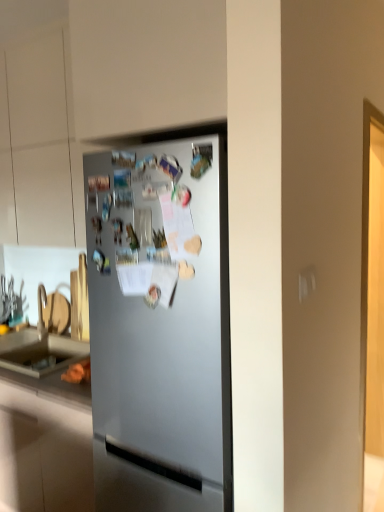
Question: Can you confirm if matte gray countertop at lower left is wider than satin silver fridge at center?

Choices:
 (A) no
 (B) yes

Answer: (A)

Question: Does matte gray countertop at lower left turn towards satin silver fridge at center?

Choices:
 (A) yes
 (B) no

Answer: (B)

Question: Can you confirm if matte gray countertop at lower left is positioned to the left of satin silver fridge at center?

Choices:
 (A) no
 (B) yes

Answer: (B)

Question: From a real-world perspective, is matte gray countertop at lower left on satin silver fridge at center?

Choices:
 (A) yes
 (B) no

Answer: (B)

Question: From the image's perspective, is matte gray countertop at lower left over satin silver fridge at center?

Choices:
 (A) yes
 (B) no

Answer: (B)

Question: Is satin silver fridge at center a part of matte gray countertop at lower left?

Choices:
 (A) no
 (B) yes

Answer: (A)

Question: Does satin silver fridge at center have a lesser width compared to matte gray countertop at lower left?

Choices:
 (A) yes
 (B) no

Answer: (B)

Question: Is satin silver fridge at center facing away from matte gray countertop at lower left?

Choices:
 (A) no
 (B) yes

Answer: (A)

Question: Can you confirm if satin silver fridge at center is taller than matte gray countertop at lower left?

Choices:
 (A) no
 (B) yes

Answer: (B)

Question: From a real-world perspective, does satin silver fridge at center sit lower than matte gray countertop at lower left?

Choices:
 (A) yes
 (B) no

Answer: (B)

Question: Is satin silver fridge at center completely or partially outside of matte gray countertop at lower left?

Choices:
 (A) yes
 (B) no

Answer: (A)

Question: Is the depth of satin silver fridge at center greater than that of matte gray countertop at lower left?

Choices:
 (A) no
 (B) yes

Answer: (A)

Question: From a real-world perspective, relative to satin silver fridge at center, is matte gray countertop at lower left vertically above or below?

Choices:
 (A) below
 (B) above

Answer: (A)